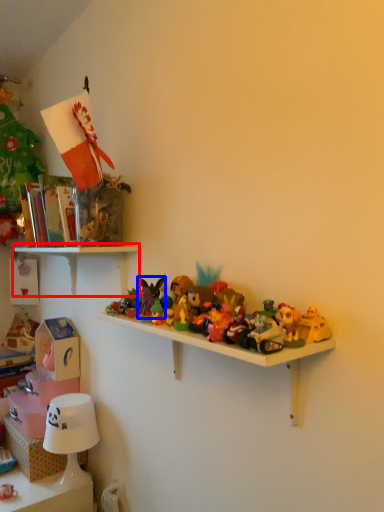
Question: Which object is further to the camera taking this photo, shelf (highlighted by a red box) or toy (highlighted by a blue box)?

Choices:
 (A) shelf
 (B) toy

Answer: (A)